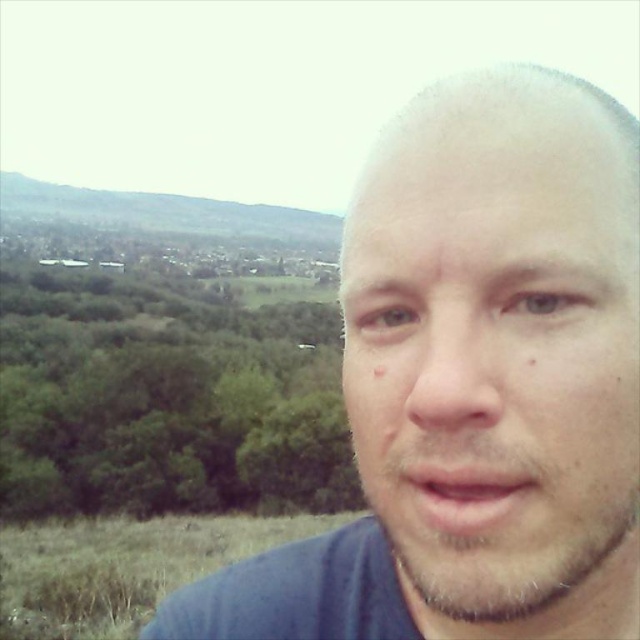
Is pale skin face at center behind green grassy hillside at upper left?

No, pale skin face at center is closer to the viewer.

Is pale skin face at center positioned before green grassy hillside at upper left?

Yes, pale skin face at center is in front of green grassy hillside at upper left.

Find the location of a particular element. The image size is (640, 640). pale skin face at center is located at coordinates (497, 356).